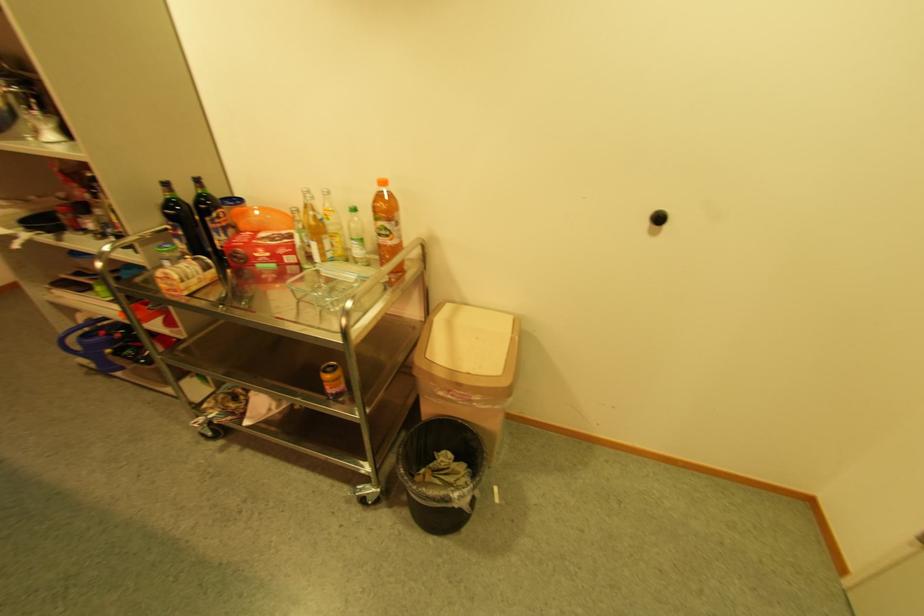
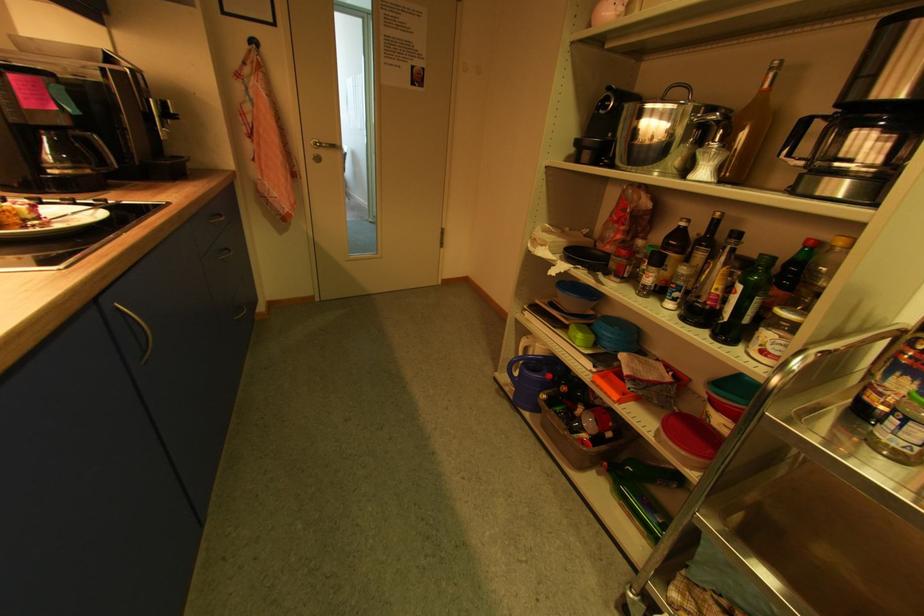
Where in the second image is the point corresponding to point (84, 349) from the first image?

(521, 375)